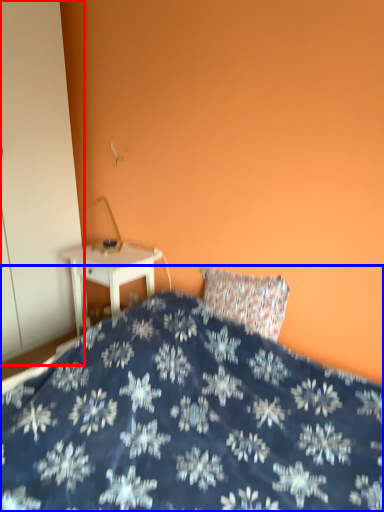
Question: Which point is closer to the camera, armoire (highlighted by a red box) or bed (highlighted by a blue box)?

Choices:
 (A) armoire
 (B) bed

Answer: (B)